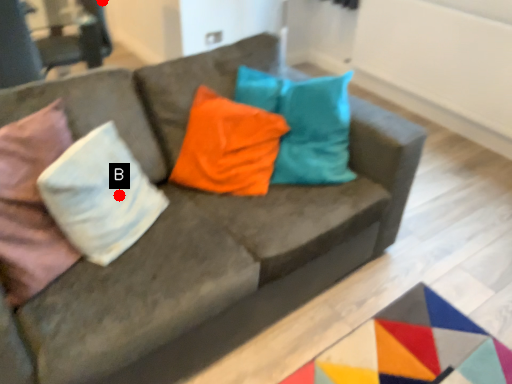
Question: Two points are circled on the image, labeled by A and B beside each circle. Which point appears closest to the camera in this image?

Choices:
 (A) A is closer
 (B) B is closer

Answer: (B)